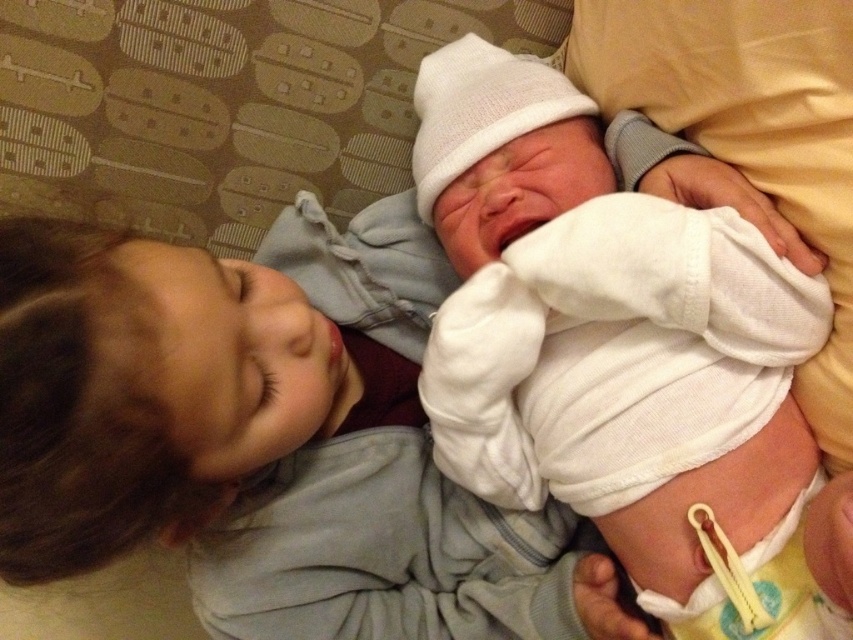
You are a photographer trying to capture a closeup shot of the white cotton newborn at center. You want to ensure the white soft cloth at center is fully visible in the frame. Given their sizes, will you need to adjust the camera angle to include both?

The white soft cloth at center is larger in width than the white cotton newborn at center, so you will need to adjust the camera angle to ensure both are fully visible in the frame.

You are holding a small toy that is 18 inches long. You want to place it on the white soft cloth at center in the image. Can the toy fit on the cloth without overlapping the edges?

The distance between the white soft cloth at center and the camera is 17.49 inches, but this measurement refers to the depth, not the size of the cloth. The provided information does not specify the cloth dimensions, so we cannot determine if the 18 inch toy will fit. Additional details about the cloth size are needed.